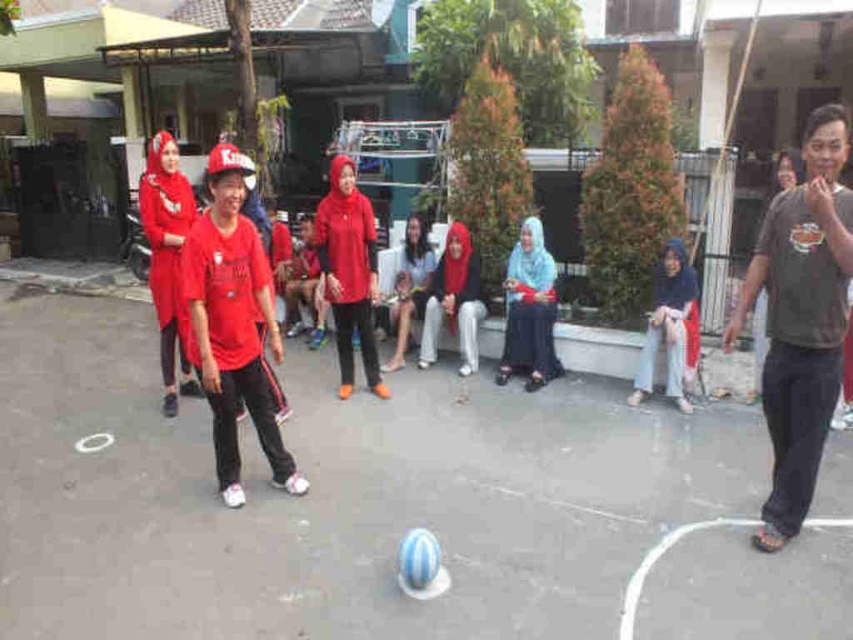
Question: Is dark gray t-shirt at right positioned in front of matte red shirt at center?

Choices:
 (A) yes
 (B) no

Answer: (A)

Question: From the image, what is the correct spatial relationship of dark gray t-shirt at right in relation to matte red shirt at center?

Choices:
 (A) below
 (B) above

Answer: (A)

Question: Does dark gray t-shirt at right lie in front of matte red shirt at center?

Choices:
 (A) yes
 (B) no

Answer: (A)

Question: Which of the following is the farthest from the observer?

Choices:
 (A) (233, 426)
 (B) (792, 467)

Answer: (A)